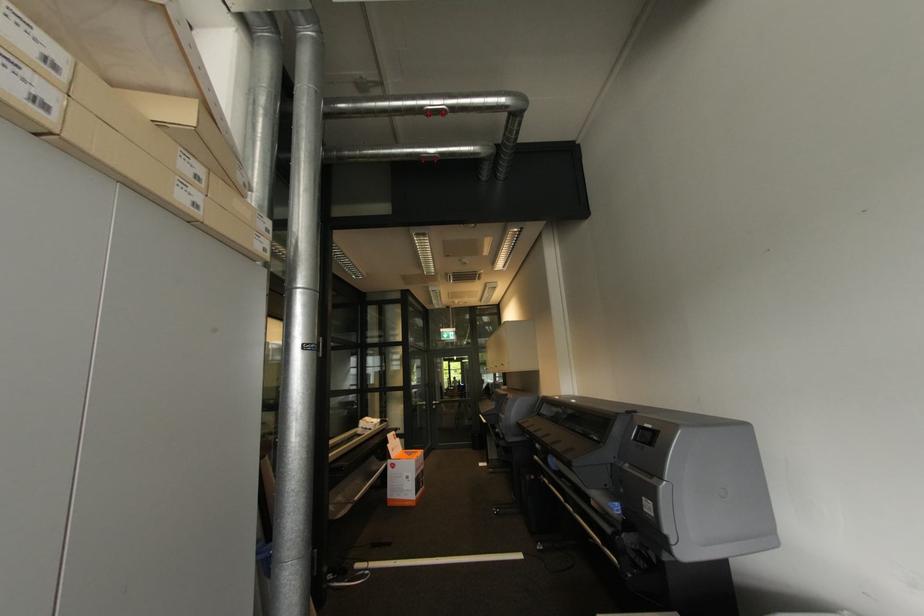
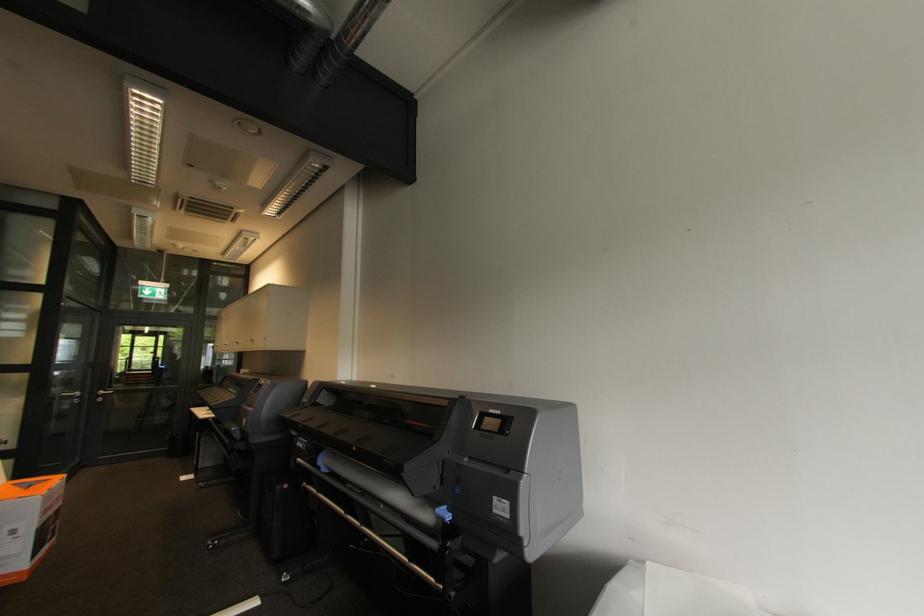
Question: How did the camera likely rotate?

Choices:
 (A) Left
 (B) Right
 (C) Up
 (D) Down

Answer: (B)